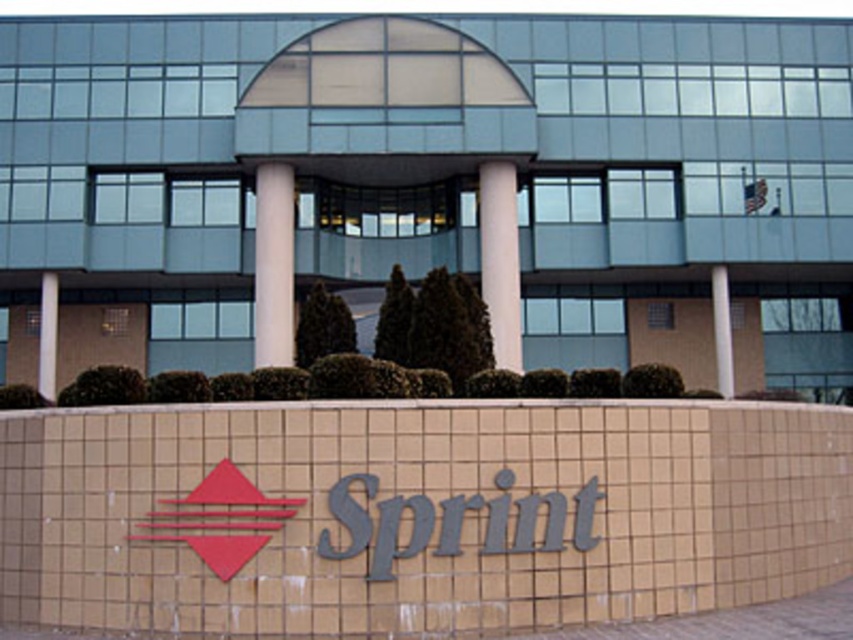
Is point (502, 180) closer to viewer compared to point (39, 292)?

Yes, it is.

Does white smooth column at center come behind white concrete pillar at left?

No.

Is point (511, 346) more distant than point (47, 381)?

That is False.

At what (x,y) coordinates should I click in order to perform the action: click on white smooth column at center. Please return your answer as a coordinate pair (x, y). The width and height of the screenshot is (853, 640). Looking at the image, I should click on (500, 260).

Between white smooth pillar at center and white concrete pillar at left, which one appears on the right side from the viewer's perspective?

white smooth pillar at center is more to the right.

Is white smooth pillar at center bigger than white concrete pillar at left?

Yes.

I want to click on white smooth pillar at center, so click(273, 266).

Can you confirm if white concrete pillar at center is positioned below white concrete pillar at left?

Actually, white concrete pillar at center is above white concrete pillar at left.

Does white concrete pillar at center have a larger size compared to white concrete pillar at left?

Correct, white concrete pillar at center is larger in size than white concrete pillar at left.

At what (x,y) coordinates should I click in order to perform the action: click on white concrete pillar at center. Please return your answer as a coordinate pair (x, y). Looking at the image, I should click on (722, 330).